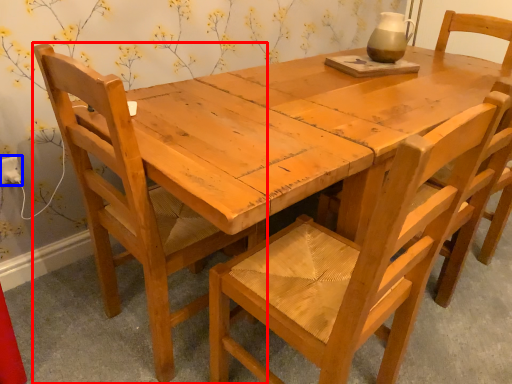
Question: Which of the following is the closest to the observer, chair (highlighted by a red box) or electric outlet (highlighted by a blue box)?

Choices:
 (A) chair
 (B) electric outlet

Answer: (A)